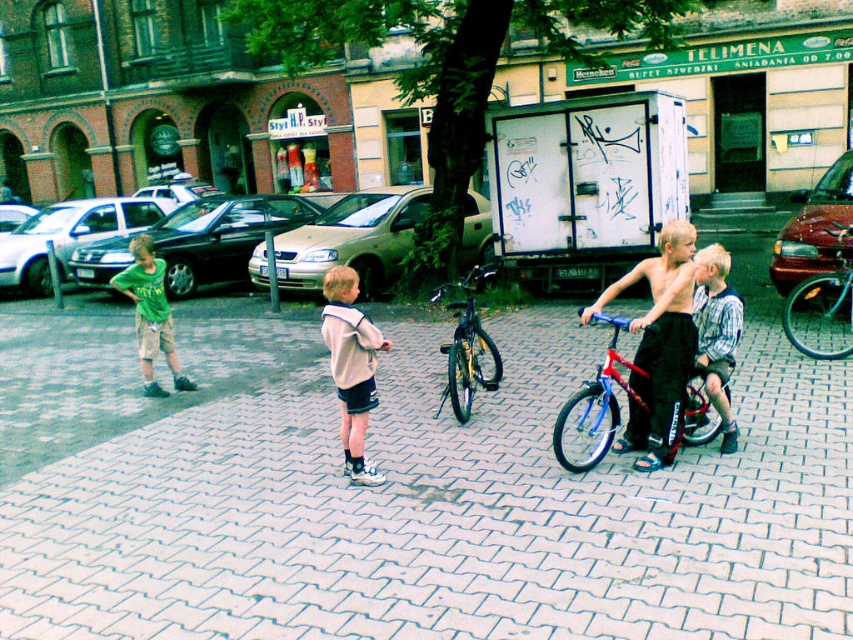
Question: Which of these objects is positioned closest to the checkered fabric shirt at center?

Choices:
 (A) blue metallic bicycle at center
 (B) white fleece jacket at center
 (C) red matte bicycle at center
 (D) shiny black shorts at center

Answer: (D)

Question: Can you confirm if checkered fabric shirt at center is positioned to the right of shiny black bicycle at center?

Choices:
 (A) yes
 (B) no

Answer: (A)

Question: Is the position of shiny black shorts at center less distant than that of green cotton shirt at left?

Choices:
 (A) no
 (B) yes

Answer: (B)

Question: Which point is closer to the camera?

Choices:
 (A) shiny black bicycle at center
 (B) shiny black shorts at center
 (C) checkered fabric shirt at center

Answer: (B)

Question: Can you confirm if red matte bicycle at center is smaller than green cotton shirt at left?

Choices:
 (A) no
 (B) yes

Answer: (A)

Question: Which object appears closest to the camera in this image?

Choices:
 (A) shiny black shorts at center
 (B) checkered fabric shirt at center
 (C) white fleece jacket at center

Answer: (A)